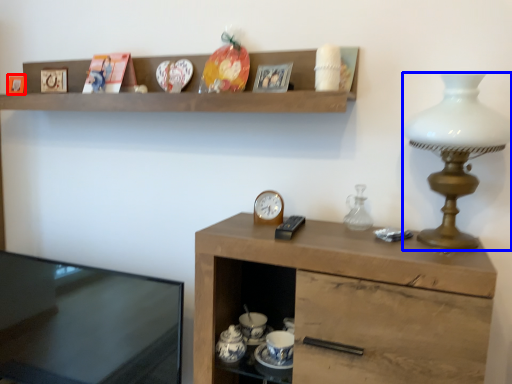
Question: Among these objects, which one is farthest to the camera, picture frame (highlighted by a red box) or lamp (highlighted by a blue box)?

Choices:
 (A) picture frame
 (B) lamp

Answer: (A)